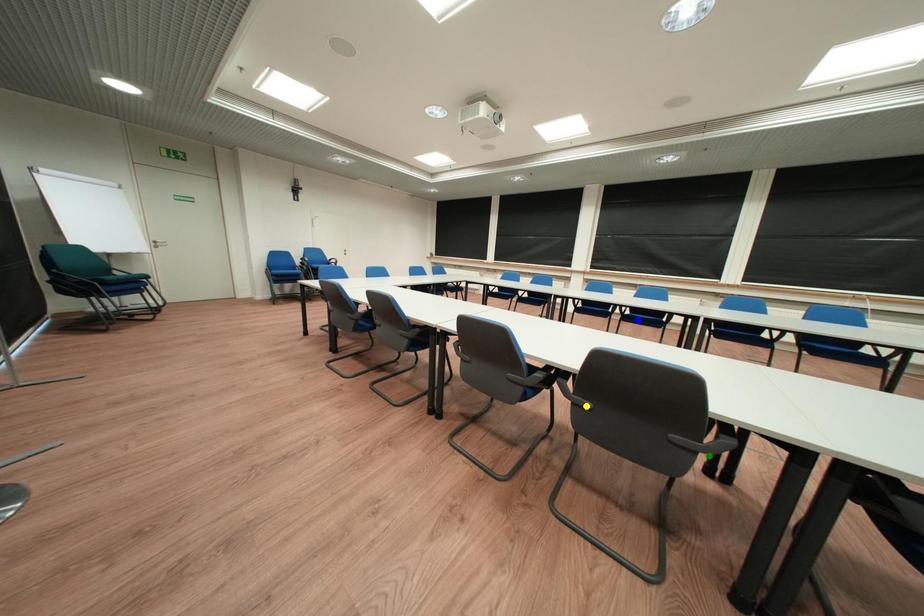
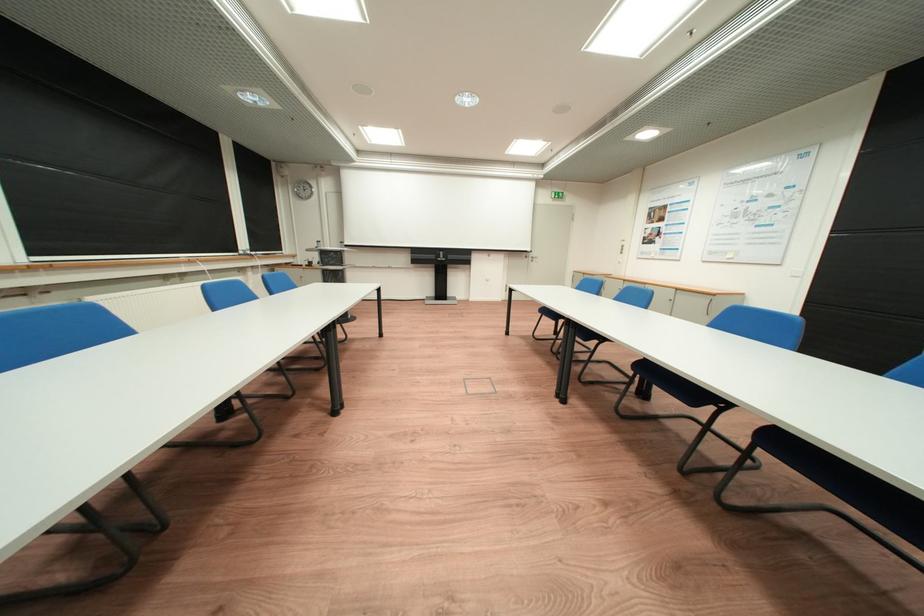
I am providing you with two images of the same scene from different viewpoints. Three points are marked in image1. Which point corresponds to a part or object that is occluded in image2?In image1, three points are marked. Which of them correspond to a part or object that is occluded in image2?Among the three points shown in image1, which one corresponds to a part or object that is no longer visible due to occlusion in image2?

yellow point, blue point, green point